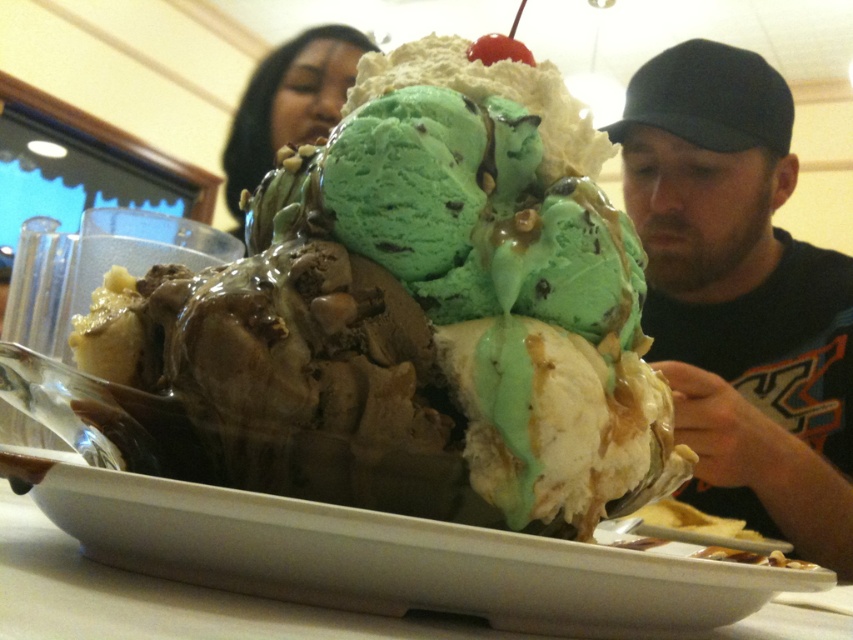
Describe the element at coordinates (405, 317) in the screenshot. I see `chocolate ice cream at center` at that location.

Is point (109, 428) positioned behind point (270, 90)?

No, (109, 428) is closer to viewer.

The image size is (853, 640). Identify the location of chocolate ice cream at center. (405, 317).

Measure the distance between point (666, 320) and camera.

Point (666, 320) is 4.43 feet from camera.

Between point (741, 481) and point (305, 100), which one is positioned behind?

Positioned behind is point (305, 100).

Is point (703, 160) closer to viewer compared to point (300, 100)?

Yes, point (703, 160) is in front of point (300, 100).

You are a GUI agent. You are given a task and a screenshot of the screen. Output one action in this format:
    pyautogui.click(x=<x>, y=<y>)
    Task: Click on the dark blue cap at right
    
    Given the screenshot: What is the action you would take?
    pyautogui.click(x=741, y=298)

Is chocolate ice cream at center bigger than dark blue cap at right?

No.

Between chocolate ice cream at center and dark blue cap at right, which one appears on the right side from the viewer's perspective?

From the viewer's perspective, dark blue cap at right appears more on the right side.

The height and width of the screenshot is (640, 853). I want to click on chocolate ice cream at center, so click(x=405, y=317).

Identify the location of chocolate ice cream at center. Image resolution: width=853 pixels, height=640 pixels. (405, 317).